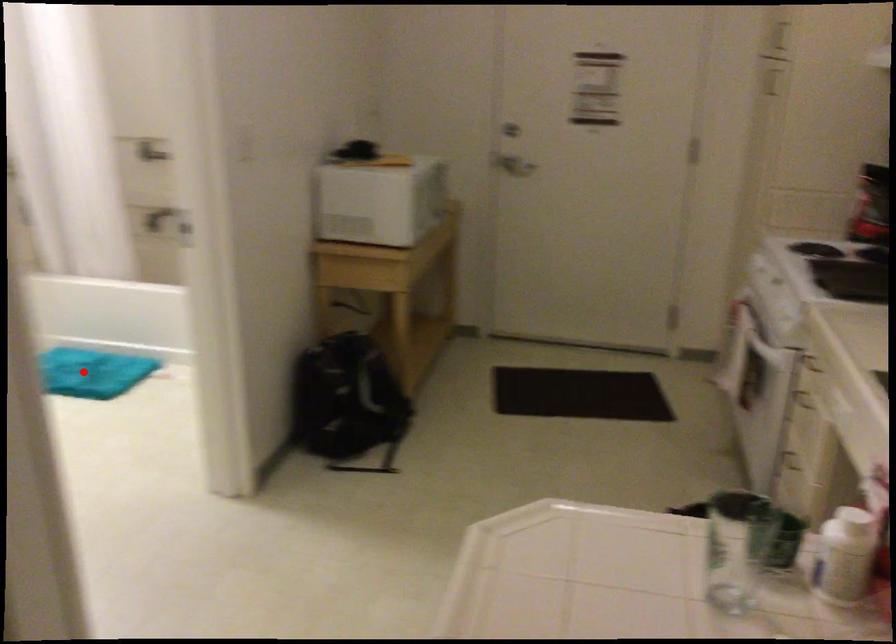
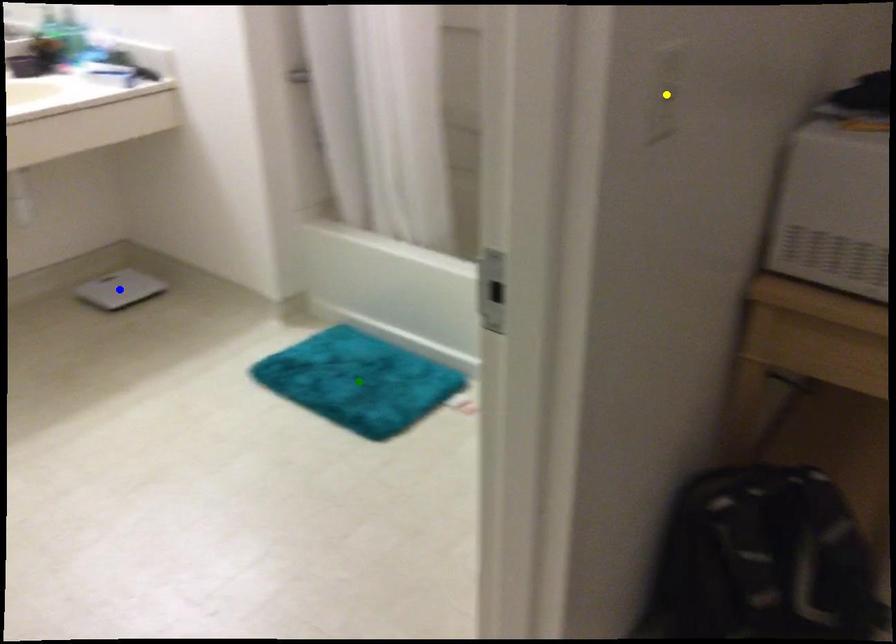
Question: I am providing you with two images of the same scene from different viewpoints. A red point is marked on the first image. You are given multiple points on the second image. Can you choose the point in image 2 that corresponds to the point in image 1?

Choices:
 (A) green point
 (B) yellow point
 (C) blue point

Answer: (A)